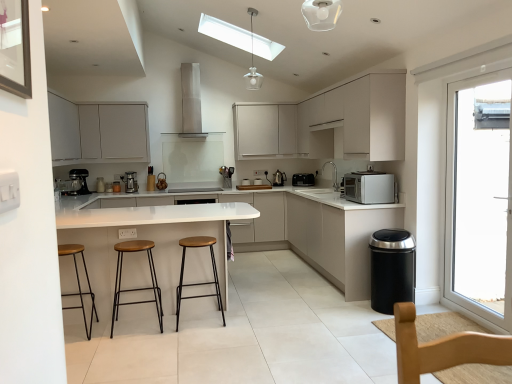
Locate an element on the screen. vacant area that is situated to the right of white glossy table at center is located at coordinates (291, 313).